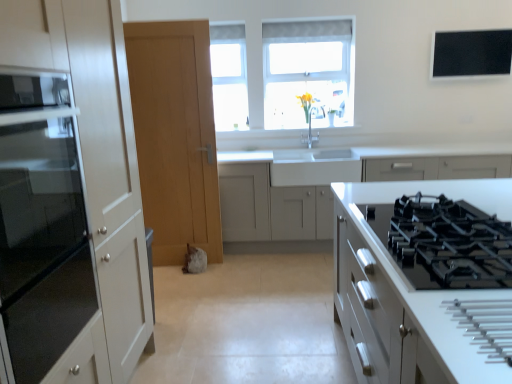
Question: Considering the positions of point (507, 49) and point (508, 165), is point (507, 49) closer or farther from the camera than point (508, 165)?

Choices:
 (A) closer
 (B) farther

Answer: (B)

Question: From the image's perspective, relative to white matte cabinet at center, which appears as the 1th cabinetry when viewed from the back, is black matte window screen at upper right above or below?

Choices:
 (A) below
 (B) above

Answer: (B)

Question: Which of these objects is positioned closest to the black glass gas stove at center right?

Choices:
 (A) yellow matte vase at upper center
 (B) matte glass cabinet at left, the second cabinetry in the back-to-front sequence
 (C) white matte cabinet at center, the 3th cabinetry when ordered from front to back
 (D) clear glass window at upper center
 (E) black matte window screen at upper right

Answer: (B)

Question: Which is nearer to the clear glass window at upper center?

Choices:
 (A) light wood door at center
 (B) white glossy stove at right, positioned as the 3th cabinetry in back-to-front order
 (C) black glass gas stove at center right
 (D) black matte window screen at upper right
 (E) yellow matte vase at upper center

Answer: (E)